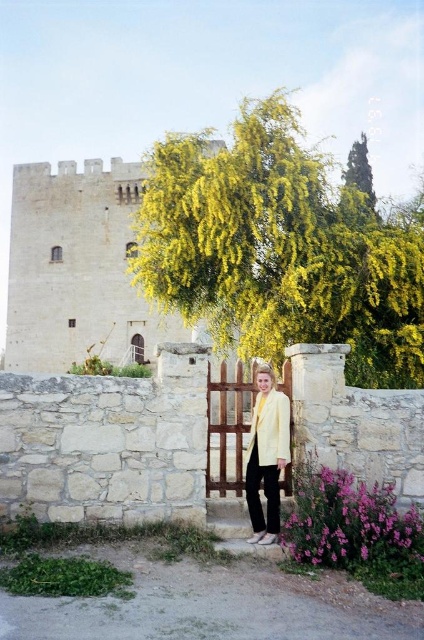
You are a drone operator trying to capture a photo of the yellow blossoms on the tree in the background. You notice a point at coordinates (279, 250) marked as yellow green foliage at center. Will this point help you locate the yellow blossoms?

The point at coordinates (279, 250) indicates yellow green foliage at center, which is part of the tree with vibrant yellow blossoms in the background. This point can help locate the yellow blossoms as it is positioned at the center of the foliage area.